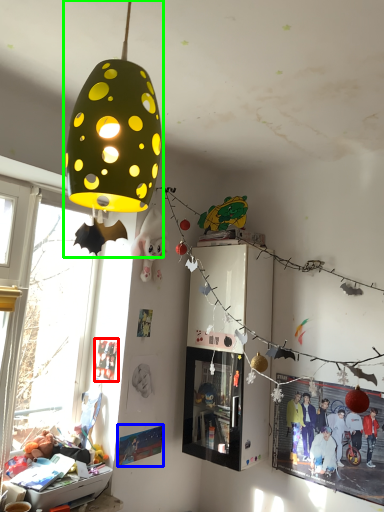
Question: Based on their relative distances, which object is farther from poster page (highlighted by a red box)? Choose from poster page (highlighted by a blue box) and lamp (highlighted by a green box).

Choices:
 (A) poster page
 (B) lamp

Answer: (B)